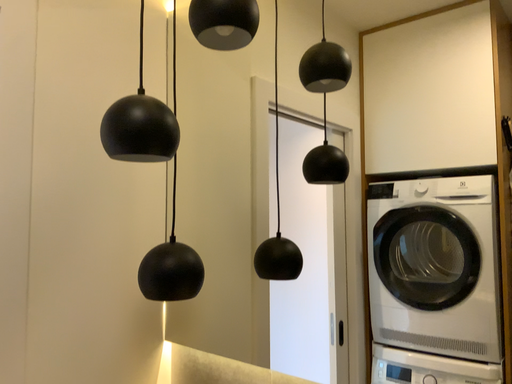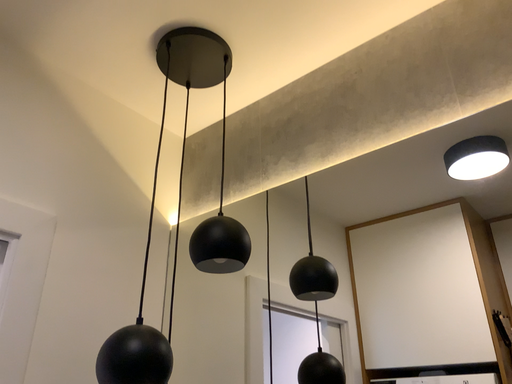
Question: How did the camera likely rotate when shooting the video?

Choices:
 (A) rotated upward
 (B) rotated downward

Answer: (A)